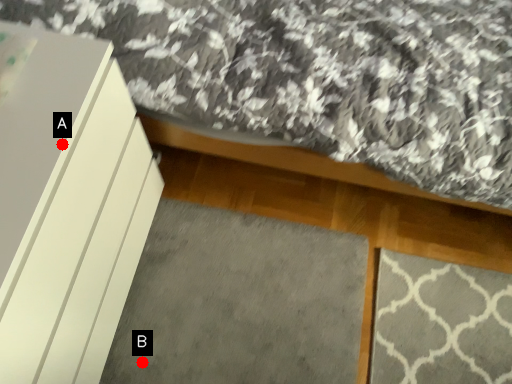
Question: Two points are circled on the image, labeled by A and B beside each circle. Among these points, which one is nearest to the camera?

Choices:
 (A) A is closer
 (B) B is closer

Answer: (A)